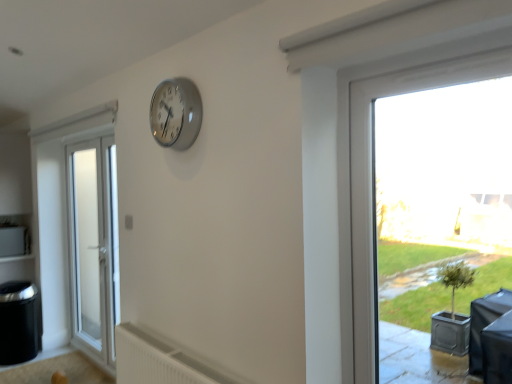
Question: Is silver metallic clock at upper center at the back of transparent glass window at right?

Choices:
 (A) no
 (B) yes

Answer: (A)

Question: Can you confirm if transparent glass window at right is smaller than silver metallic clock at upper center?

Choices:
 (A) yes
 (B) no

Answer: (B)

Question: Can you confirm if transparent glass window at right is wider than silver metallic clock at upper center?

Choices:
 (A) no
 (B) yes

Answer: (A)

Question: Does transparent glass window at right turn towards silver metallic clock at upper center?

Choices:
 (A) yes
 (B) no

Answer: (B)

Question: Considering the relative positions of transparent glass window at right and silver metallic clock at upper center in the image provided, is transparent glass window at right to the right of silver metallic clock at upper center from the viewer's perspective?

Choices:
 (A) yes
 (B) no

Answer: (A)

Question: Does point (159, 360) appear closer or farther from the camera than point (362, 377)?

Choices:
 (A) farther
 (B) closer

Answer: (A)

Question: From their relative heights in the image, would you say white plastic radiator at lower center is taller or shorter than transparent glass window at right?

Choices:
 (A) short
 (B) tall

Answer: (A)

Question: From a real-world perspective, is white plastic radiator at lower center positioned above or below transparent glass window at right?

Choices:
 (A) below
 (B) above

Answer: (A)

Question: Considering the relative positions of white plastic radiator at lower center and transparent glass window at right in the image provided, is white plastic radiator at lower center to the left or to the right of transparent glass window at right?

Choices:
 (A) right
 (B) left

Answer: (B)

Question: Is transparent glass window at right inside the boundaries of white frosted glass door at left, or outside?

Choices:
 (A) outside
 (B) inside

Answer: (A)

Question: Is transparent glass window at right taller or shorter than white frosted glass door at left?

Choices:
 (A) tall
 (B) short

Answer: (B)

Question: Does point (352, 235) appear closer or farther from the camera than point (70, 162)?

Choices:
 (A) farther
 (B) closer

Answer: (B)

Question: In terms of size, does transparent glass window at right appear bigger or smaller than white frosted glass door at left?

Choices:
 (A) big
 (B) small

Answer: (B)

Question: Considering the positions of transparent glass window at right and white plastic radiator at lower center in the image, is transparent glass window at right wider or thinner than white plastic radiator at lower center?

Choices:
 (A) thin
 (B) wide

Answer: (A)

Question: In the image, is transparent glass window at right positioned in front of or behind white plastic radiator at lower center?

Choices:
 (A) front
 (B) behind

Answer: (A)